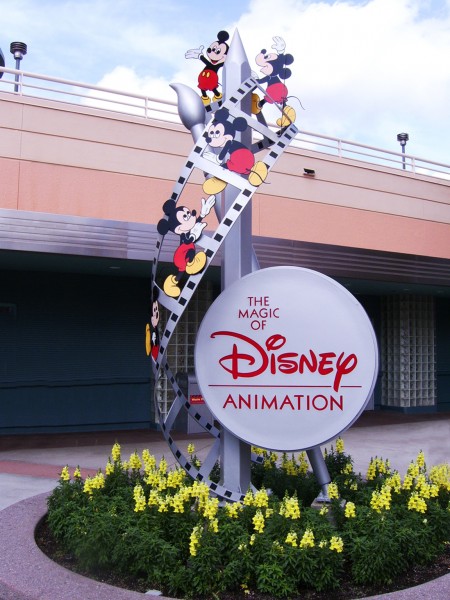
At what (x,y) coordinates should I click in order to perform the action: click on plant. Please return your answer as a coordinate pair (x, y). Looking at the image, I should click on (123, 541).